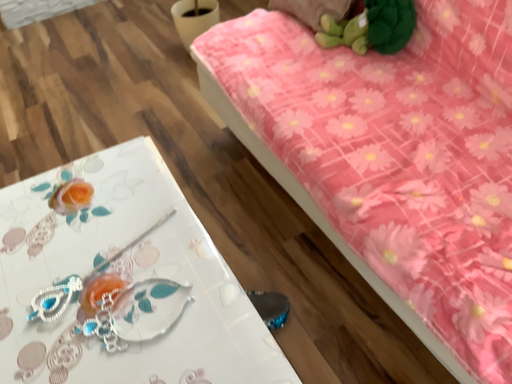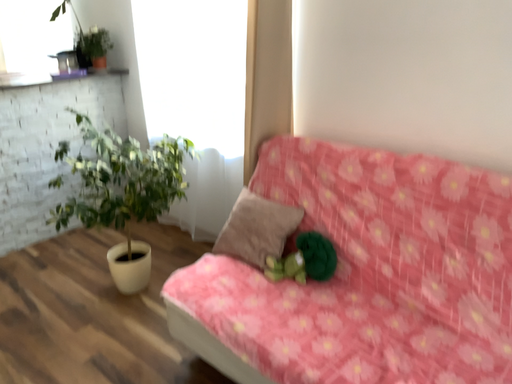
Question: How did the camera likely rotate when shooting the video?

Choices:
 (A) rotated downward
 (B) rotated upward

Answer: (B)